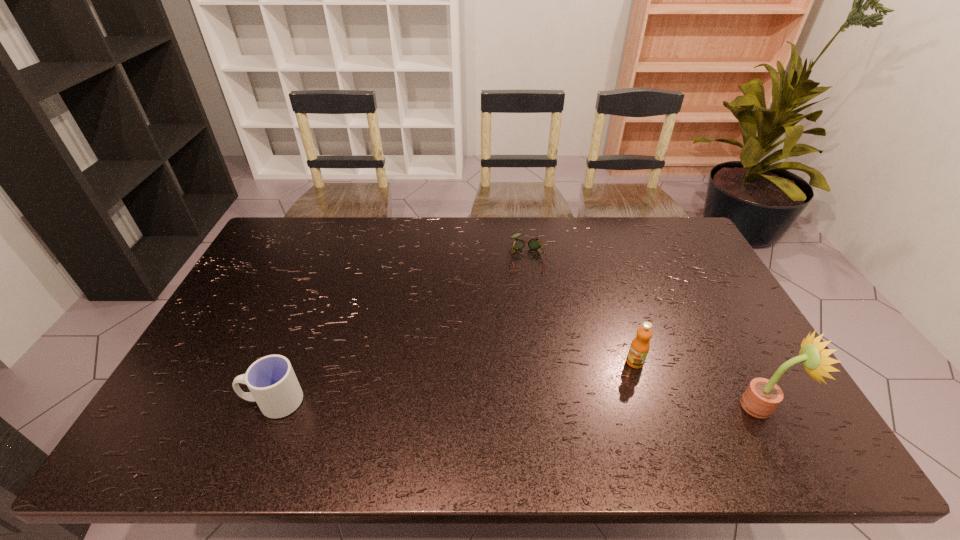
Identify the location of vacant point located between the third shortest object and the cup. Image resolution: width=960 pixels, height=540 pixels. (454, 382).

Identify the location of vacant area that lies between the tallest object and the cup. This screenshot has height=540, width=960. (517, 403).

At what (x,y) coordinates should I click in order to perform the action: click on free space between the cup and the farthest object. Please return your answer as a coordinate pair (x, y). This screenshot has width=960, height=540. Looking at the image, I should click on (400, 329).

Identify the location of vacant region between the orange juice and the farthest object. The width and height of the screenshot is (960, 540). (581, 309).

In order to click on unoccupied area between the sunflower and the third nearest object in this screenshot , I will do `click(699, 384)`.

Locate an element on the screen. The height and width of the screenshot is (540, 960). vacant region between the orange juice and the cup is located at coordinates (454, 382).

Identify the location of vacant area that lies between the cup and the farthest object. The image size is (960, 540). (400, 329).

Locate an element on the screen. The width and height of the screenshot is (960, 540). object that is the second nearest to the second farthest object is located at coordinates (535, 244).

Choose which object is the third nearest neighbor to the rightmost object. Please provide its 2D coordinates. Your answer should be formatted as a tuple, i.e. [(x, y)], where the tuple contains the x and y coordinates of a point satisfying the conditions above.

[(273, 385)]

Image resolution: width=960 pixels, height=540 pixels. I want to click on free location that satisfies the following two spatial constraints: 1. on the front side of the tallest object; 2. on the face of the orange juice, so click(649, 406).